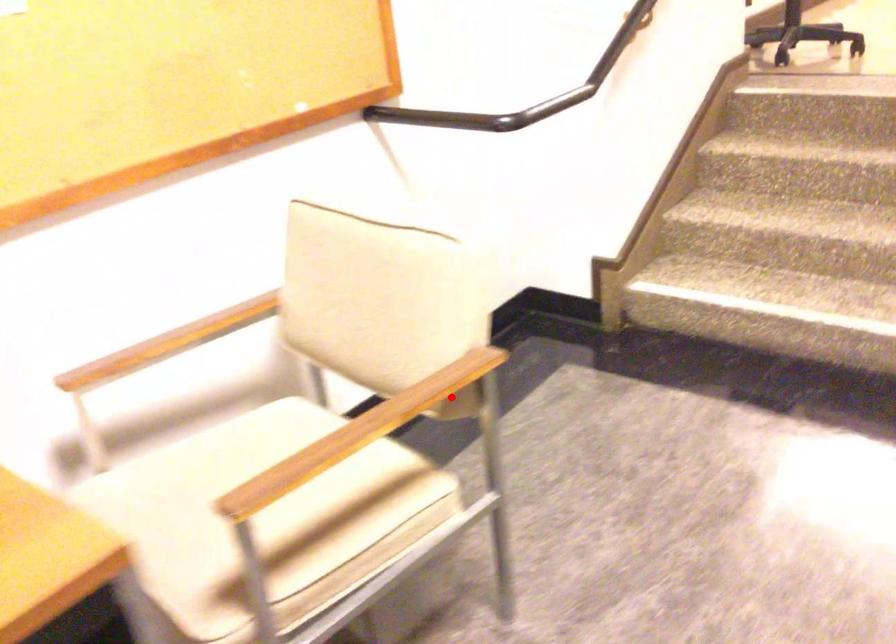
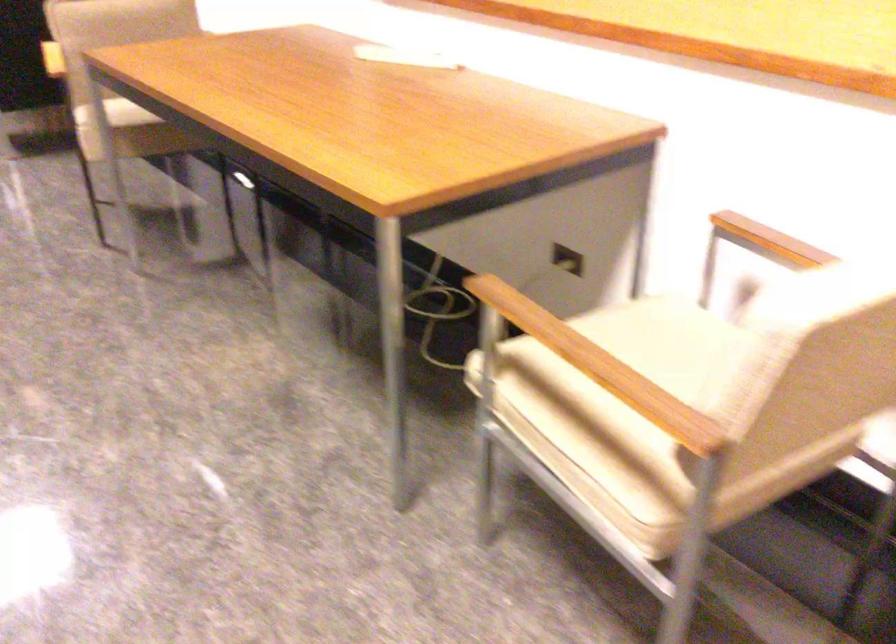
The point at the highlighted location is marked in the first image. Where is the corresponding point in the second image?

(619, 399)